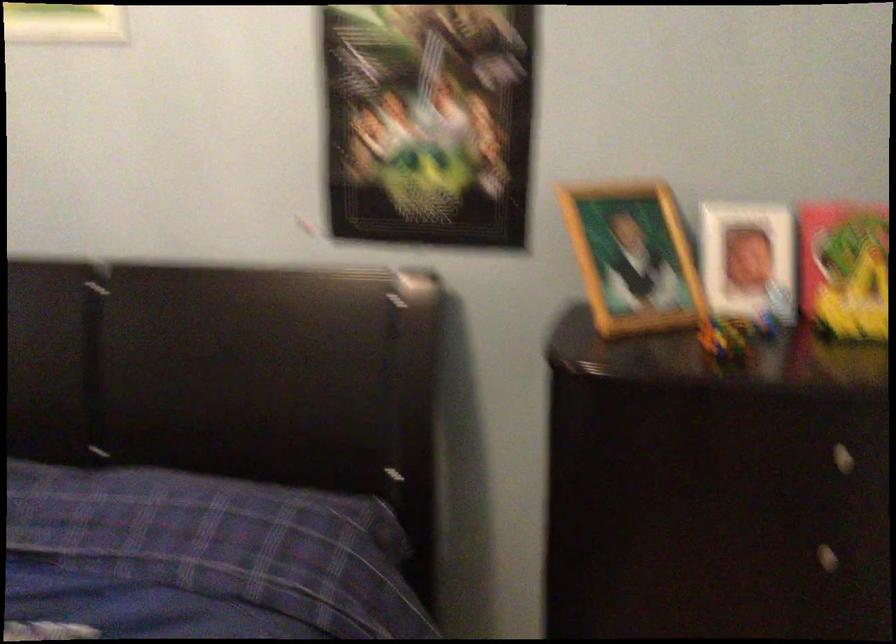
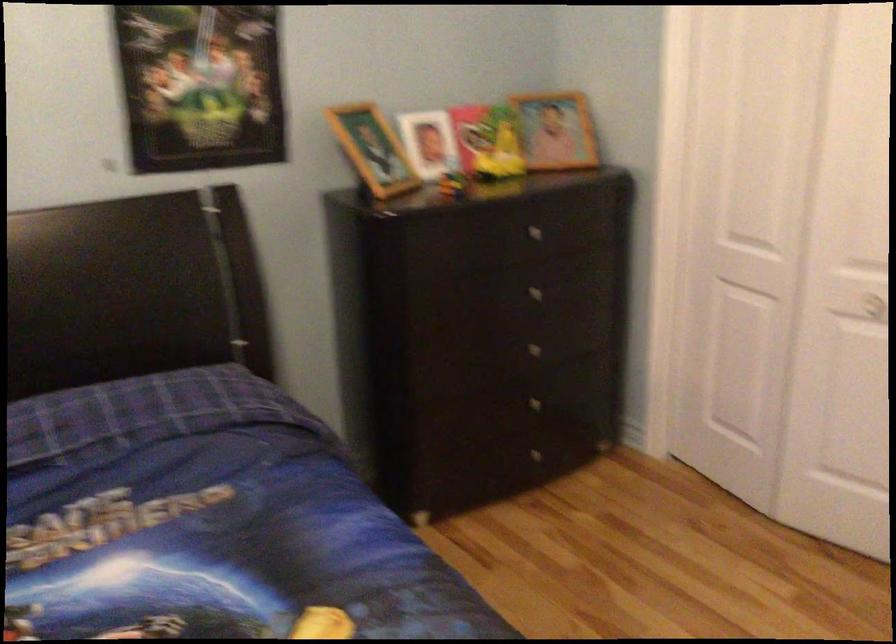
In the second image, find the point that corresponds to (x=632, y=261) in the first image.

(373, 149)